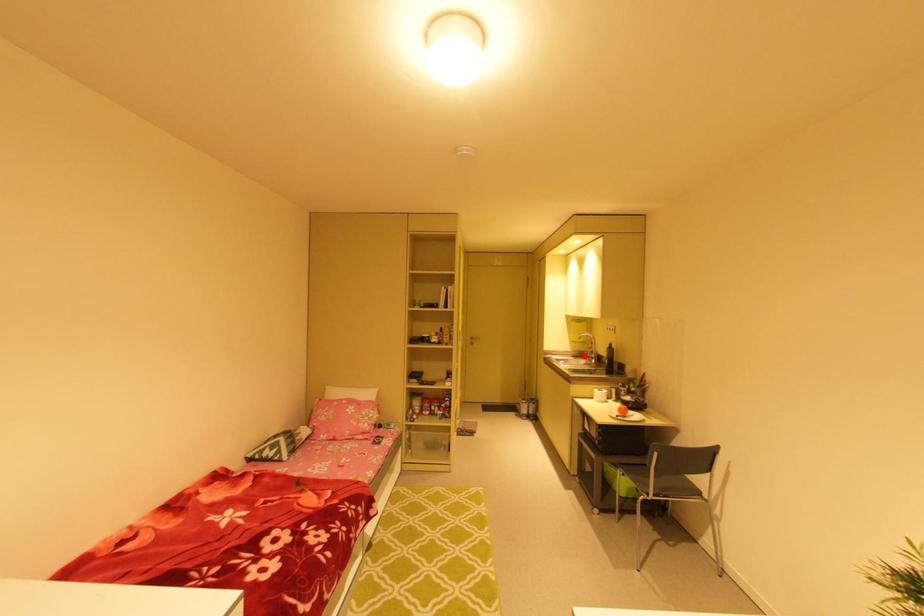
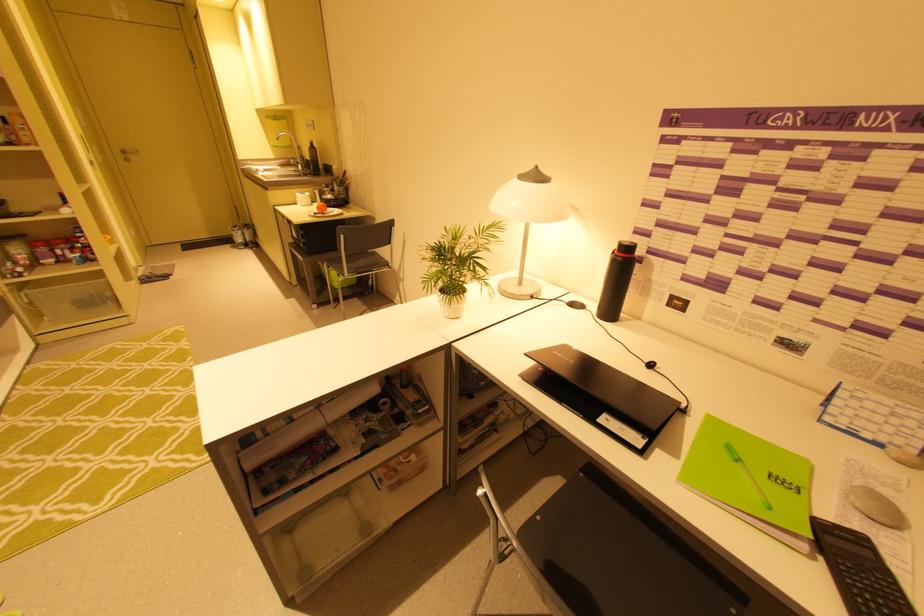
The point at the highlighted location is marked in the first image. Where is the corresponding point in the second image?

(293, 164)